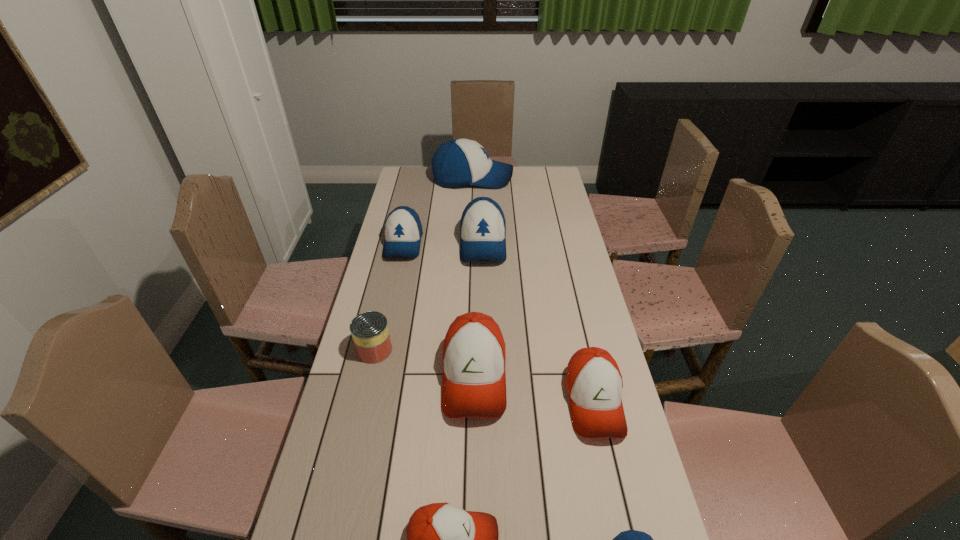
Locate an element on the screen. This screenshot has height=540, width=960. vacant space located on the front-facing side of the third biggest blue baseball cap is located at coordinates (390, 307).

Find the location of a particular element. free location located on the front-facing side of the second smallest orange baseball cap is located at coordinates (616, 503).

Find the location of `vacant space situated 0.150m on the right of the can`. vacant space situated 0.150m on the right of the can is located at coordinates (441, 350).

Locate an element on the screen. This screenshot has width=960, height=540. object at the far edge is located at coordinates (459, 162).

At what (x,y) coordinates should I click in order to perform the action: click on can that is at the left edge. Please return your answer as a coordinate pair (x, y). Looking at the image, I should click on 369,330.

Where is `object at the right edge`? object at the right edge is located at coordinates (594, 384).

You are a GUI agent. You are given a task and a screenshot of the screen. Output one action in this format:
    pyautogui.click(x=<x>, y=<y>)
    Task: Click on the object that is at the far left corner
    This screenshot has height=540, width=960.
    Given the screenshot: What is the action you would take?
    pyautogui.click(x=459, y=162)

I want to click on vacant space at the left edge of the desktop, so 400,346.

Find the location of a particular element. vacant space at the right edge is located at coordinates click(578, 268).

This screenshot has width=960, height=540. Identify the location of vacant space at the far right corner of the desktop. (555, 173).